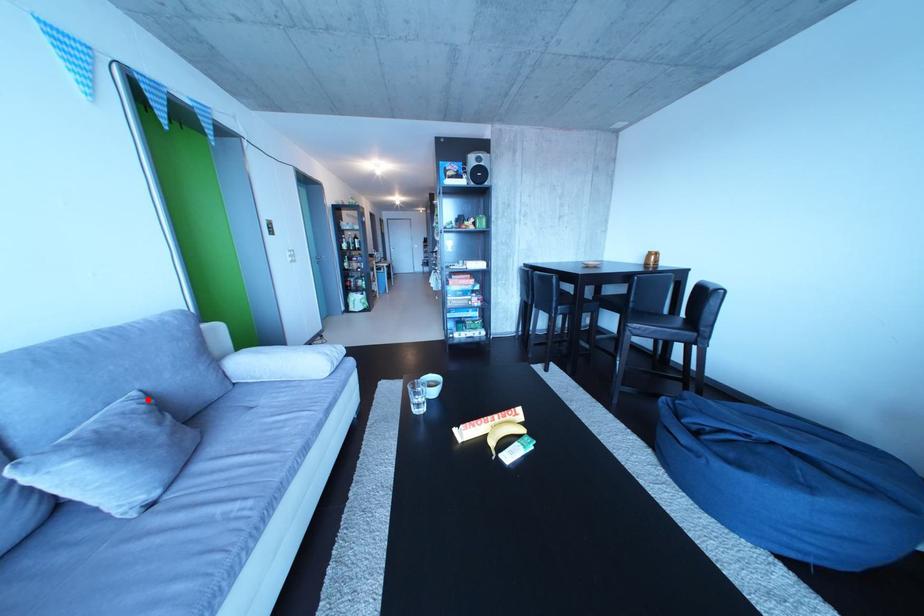
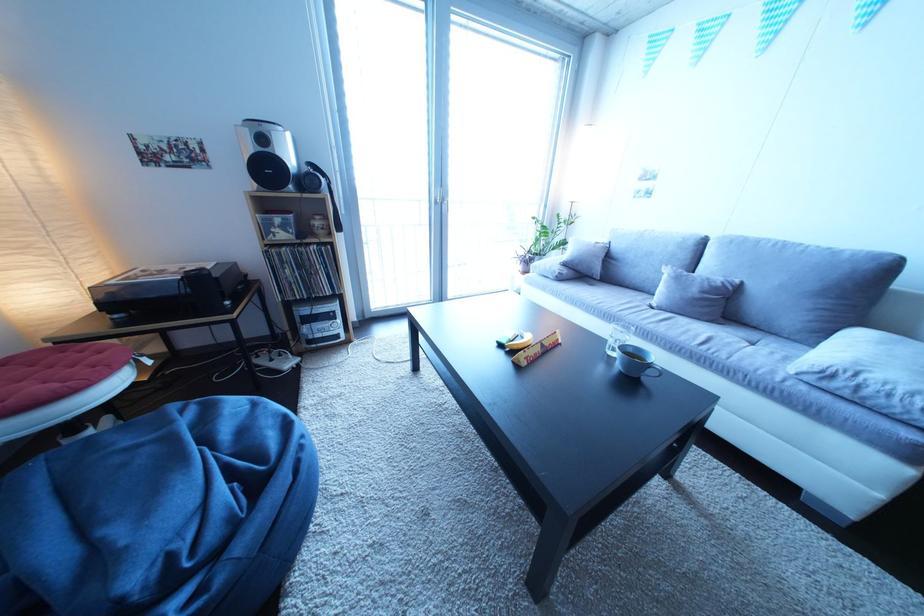
In the second image, find the point that corresponds to the highlighted location in the first image.

(750, 286)